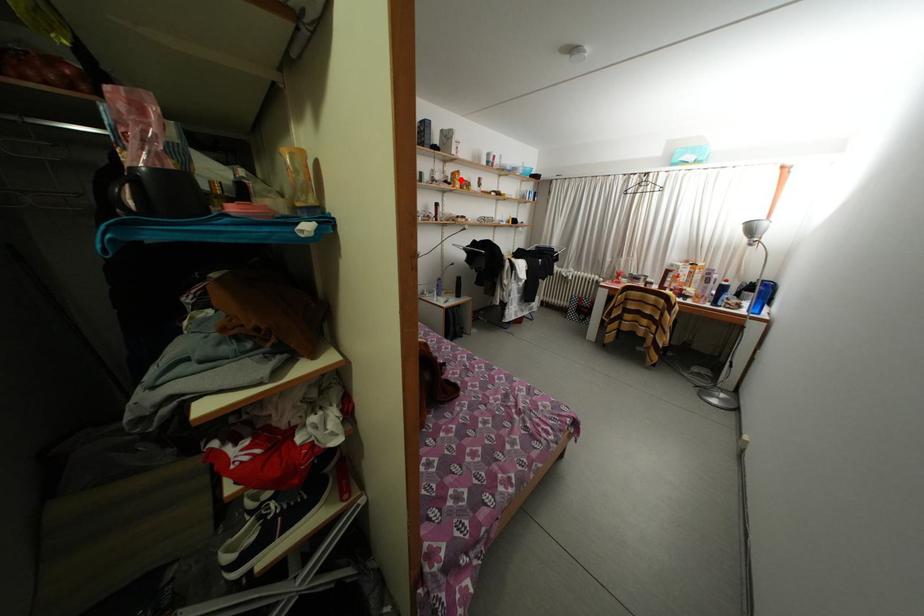
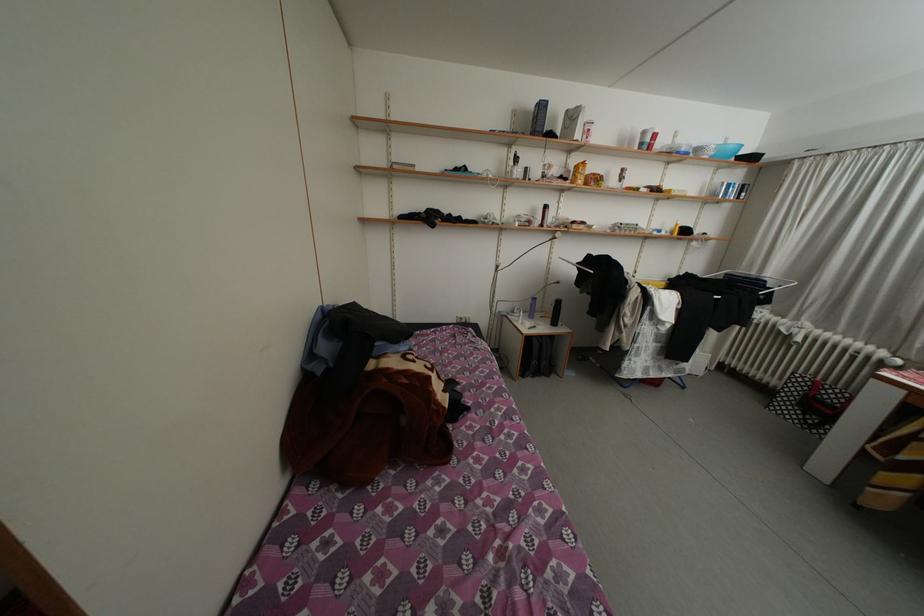
Locate, in the second image, the point that corresponds to the highlighted location in the first image.

(584, 172)